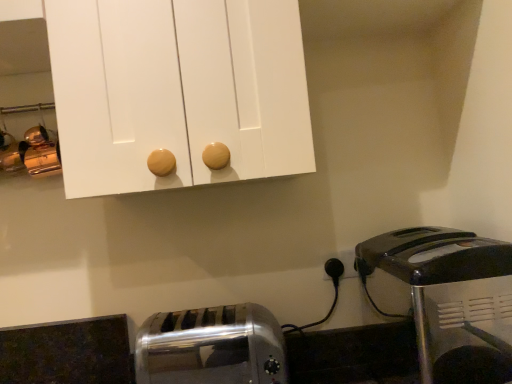
Question: In terms of height, does satin silver toaster at lower left, the second toaster in the right-to-left sequence, look taller or shorter compared to black plastic toaster at lower right, the second toaster from the left?

Choices:
 (A) short
 (B) tall

Answer: (A)

Question: From a real-world perspective, is satin silver toaster at lower left, which appears as the first toaster when viewed from the left, physically located above or below black plastic toaster at lower right, arranged as the first toaster when viewed from the right?

Choices:
 (A) below
 (B) above

Answer: (A)

Question: Based on their positions, is satin silver toaster at lower left, which appears as the first toaster when viewed from the left, located to the left or right of black plastic toaster at lower right, the second toaster from the left?

Choices:
 (A) right
 (B) left

Answer: (B)

Question: Considering the positions of black plastic toaster at lower right, arranged as the first toaster when viewed from the right, and satin silver toaster at lower left, which appears as the first toaster when viewed from the left, in the image, is black plastic toaster at lower right, arranged as the first toaster when viewed from the right, taller or shorter than satin silver toaster at lower left, which appears as the first toaster when viewed from the left,?

Choices:
 (A) tall
 (B) short

Answer: (A)

Question: Is black plastic toaster at lower right, the second toaster from the left, wider or thinner than satin silver toaster at lower left, which appears as the first toaster when viewed from the left?

Choices:
 (A) thin
 (B) wide

Answer: (B)

Question: Is black plastic toaster at lower right, arranged as the first toaster when viewed from the right, in front of or behind satin silver toaster at lower left, which appears as the first toaster when viewed from the left, in the image?

Choices:
 (A) behind
 (B) front

Answer: (B)

Question: Based on their positions, is black plastic toaster at lower right, arranged as the first toaster when viewed from the right, located to the left or right of satin silver toaster at lower left, which appears as the first toaster when viewed from the left?

Choices:
 (A) right
 (B) left

Answer: (A)